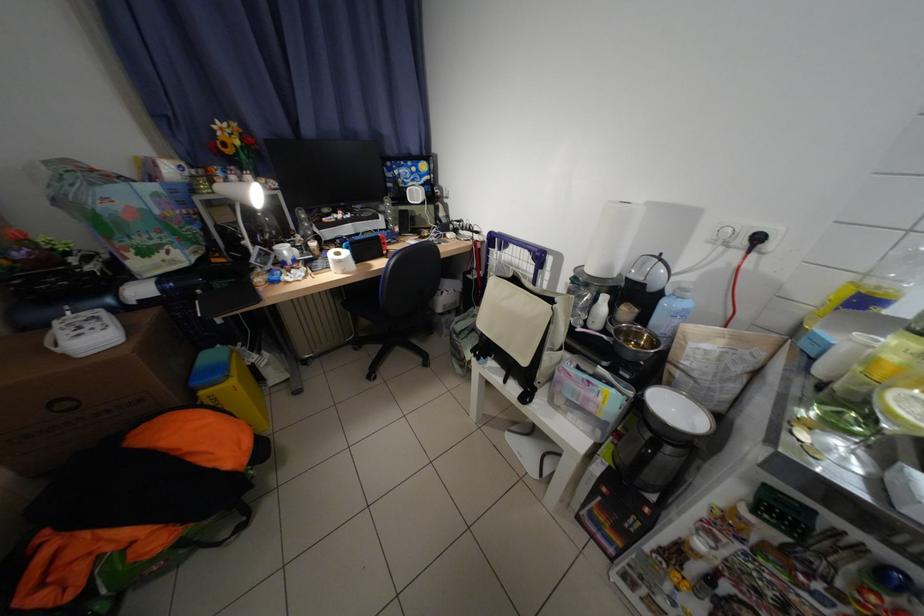
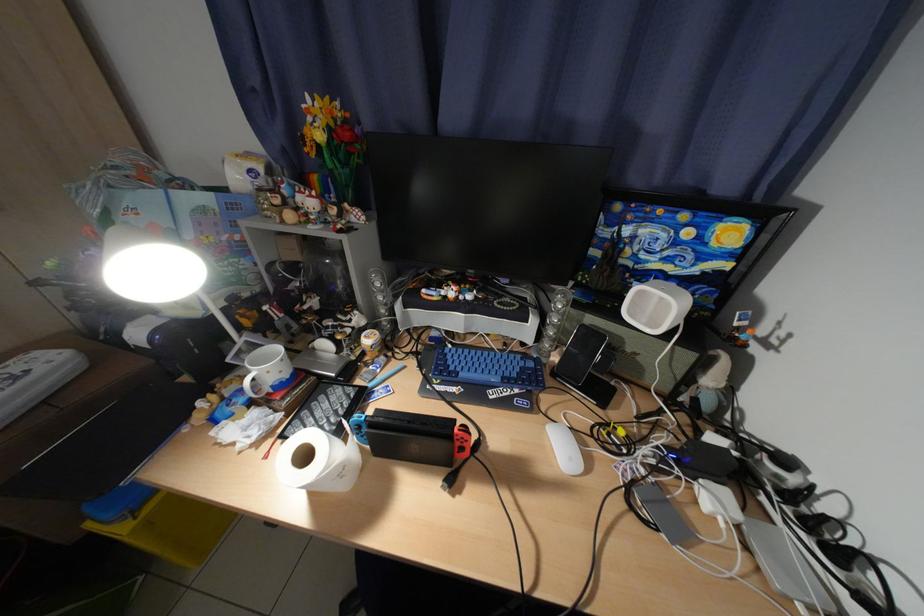
Locate, in the second image, the point that corresponds to (407,174) in the first image.

(638, 233)